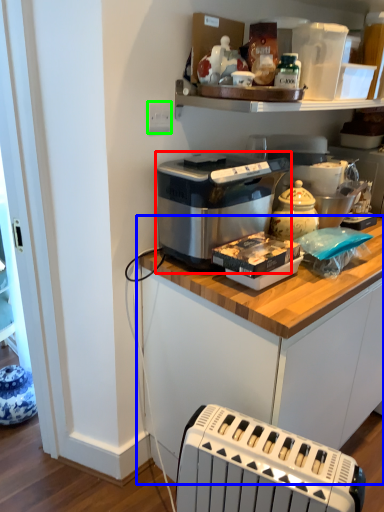
Question: Which object is positioned closest to home appliance (highlighted by a red box)? Select from cabinetry (highlighted by a blue box) and electric outlet (highlighted by a green box).

Choices:
 (A) cabinetry
 (B) electric outlet

Answer: (A)